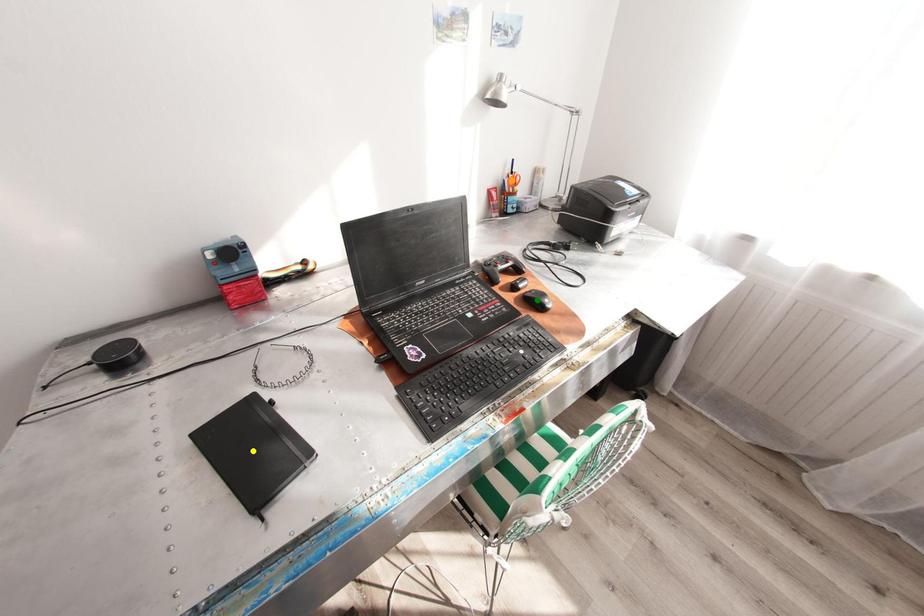
Order these from nearest to farthest:
orange point, yellow point, green point

yellow point → green point → orange point